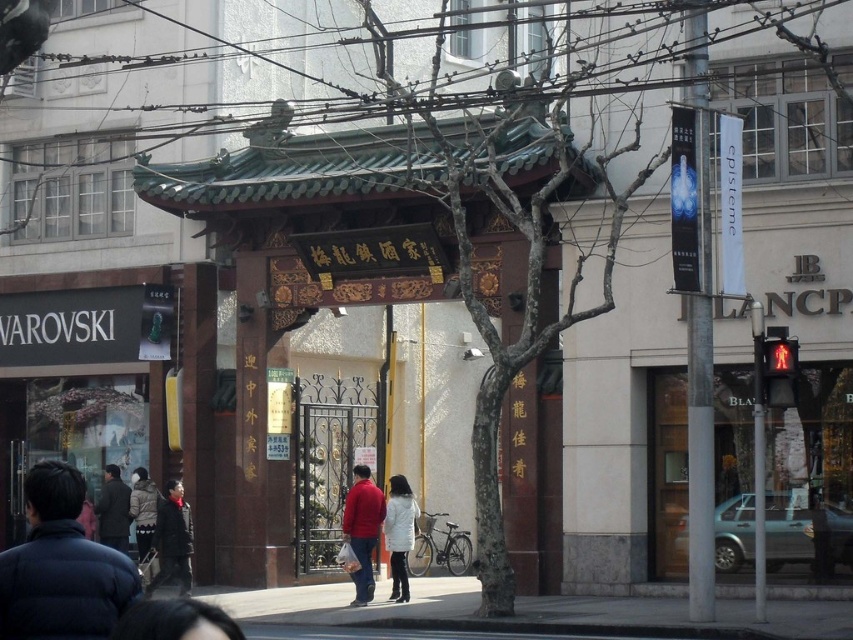
Can you confirm if white wool coat at center is taller than dark brown jacket at lower left?

Correct, white wool coat at center is much taller as dark brown jacket at lower left.

Between point (405, 486) and point (154, 513), which one is positioned in front?

Point (405, 486) is more forward.

Locate an element on the screen. white wool coat at center is located at coordinates (399, 532).

Is point (381, 509) in front of point (155, 499)?

Yes, it is.

Measure the distance between red matte jacket at center and dark brown jacket at lower left.

6.37 meters

I want to click on red matte jacket at center, so click(363, 529).

Can you confirm if dark blue jacket at lower left is positioned above dark brown jacket at lower left?

Yes.

Is point (83, 608) positioned behind point (146, 545)?

No, it is in front of (146, 545).

Is point (61, 524) closer to camera compared to point (142, 499)?

Yes.

You are a GUI agent. You are given a task and a screenshot of the screen. Output one action in this format:
    pyautogui.click(x=<x>, y=<y>)
    Task: Click on the dark blue jacket at lower left
    This screenshot has width=853, height=640.
    Given the screenshot: What is the action you would take?
    pyautogui.click(x=61, y=566)